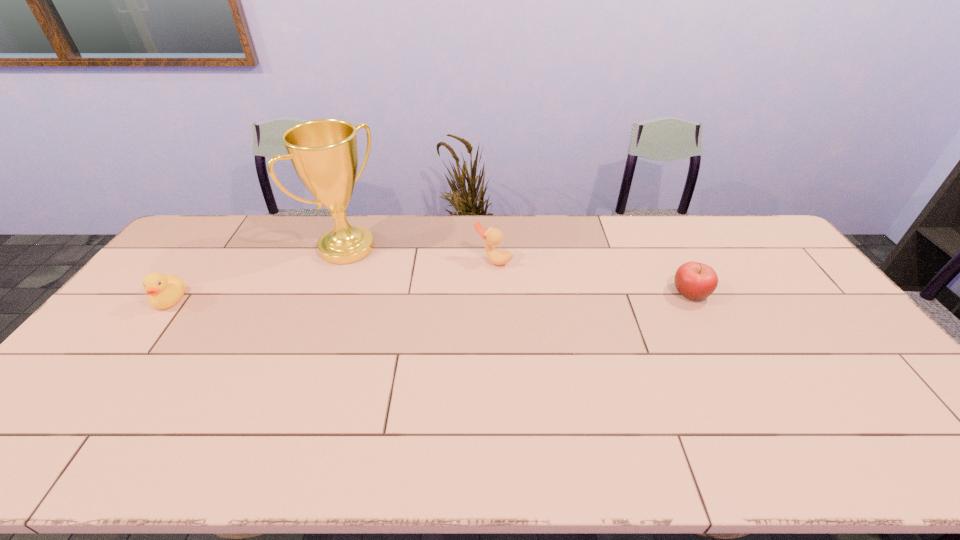
The width and height of the screenshot is (960, 540). I want to click on free space on the desktop that is between the leftmost object and the apple and is positioned on the beak of the duck, so click(461, 296).

The height and width of the screenshot is (540, 960). Find the location of `free spot on the desktop that is between the duckling and the rightmost object and is positioned by the handles of the award`. free spot on the desktop that is between the duckling and the rightmost object and is positioned by the handles of the award is located at coordinates (425, 296).